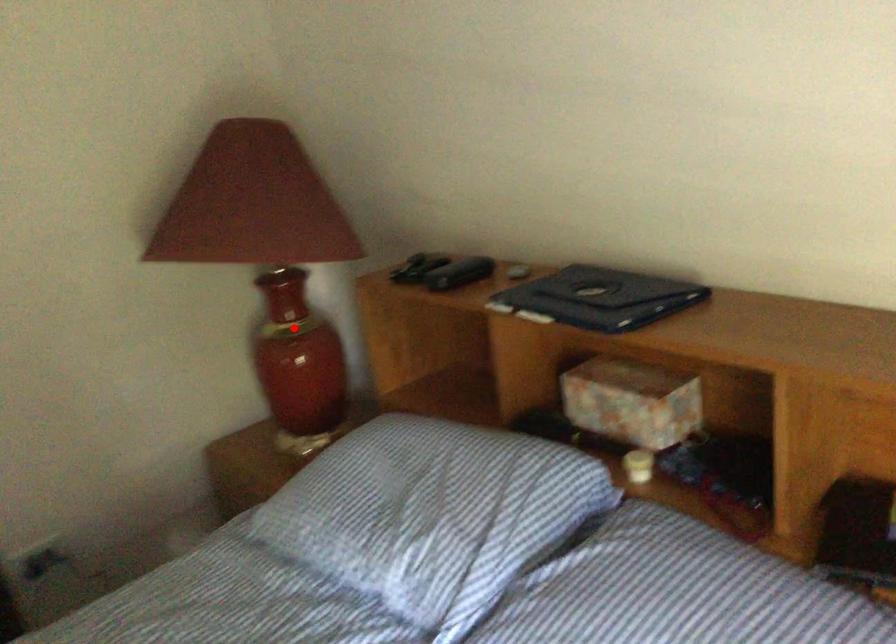
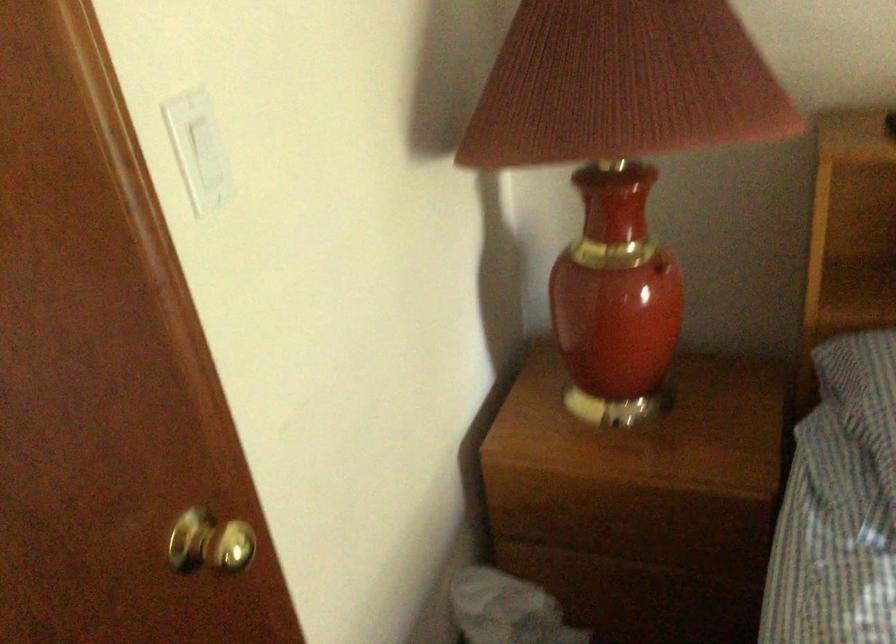
Question: I am providing you with two images of the same scene from different viewpoints. Image1 has a red point marked. In image2, the corresponding 3D location appears at what relative position? Reply with the corresponding letter.

Choices:
 (A) Closer
 (B) Farther

Answer: (A)